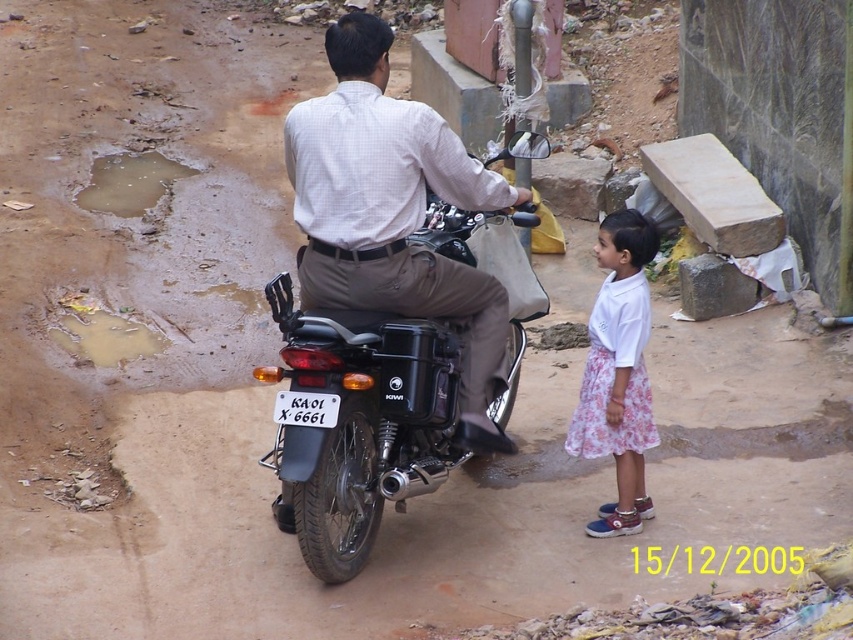
Between white checkered shirt at center and white floral skirt at lower right, which one is positioned lower?

white floral skirt at lower right

Is white checkered shirt at center below white floral skirt at lower right?

No.

Is point (393, 113) in front of point (616, 408)?

Yes, it is.

The image size is (853, 640). What are the coordinates of `white checkered shirt at center` in the screenshot? It's located at (393, 212).

How distant is white floral skirt at lower right from white plastic license plate at center?

white floral skirt at lower right and white plastic license plate at center are 4.52 feet apart from each other.

Between white floral skirt at lower right and white plastic license plate at center, which one appears on the right side from the viewer's perspective?

white floral skirt at lower right is more to the right.

Is point (631, 387) positioned before point (314, 410)?

No, it is behind (314, 410).

This screenshot has width=853, height=640. Find the location of `white floral skirt at lower right`. white floral skirt at lower right is located at coordinates (618, 372).

Between black matte motorcycle at center and white checkered shirt at center, which one is positioned lower?

black matte motorcycle at center

Who is positioned more to the right, black matte motorcycle at center or white checkered shirt at center?

white checkered shirt at center

Does point (463, 456) come closer to viewer compared to point (439, 138)?

No, it is behind (439, 138).

Identify the location of black matte motorcycle at center. The width and height of the screenshot is (853, 640). (361, 420).